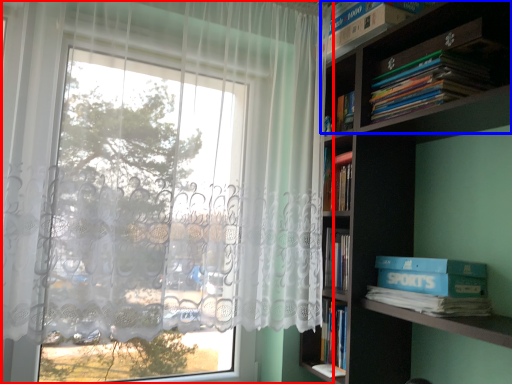
Question: Which object is closer to the camera taking this photo, curtain (highlighted by a red box) or shelf (highlighted by a blue box)?

Choices:
 (A) curtain
 (B) shelf

Answer: (A)